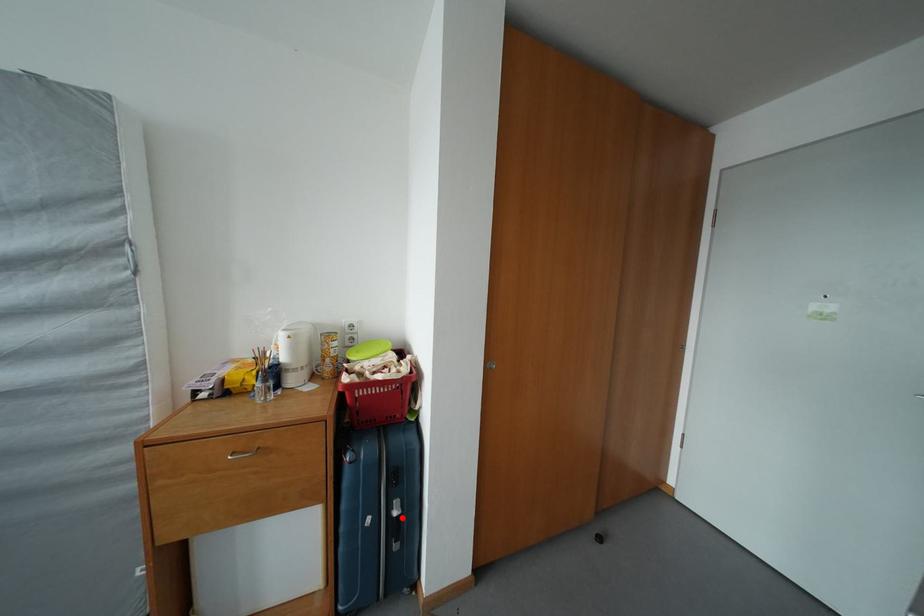
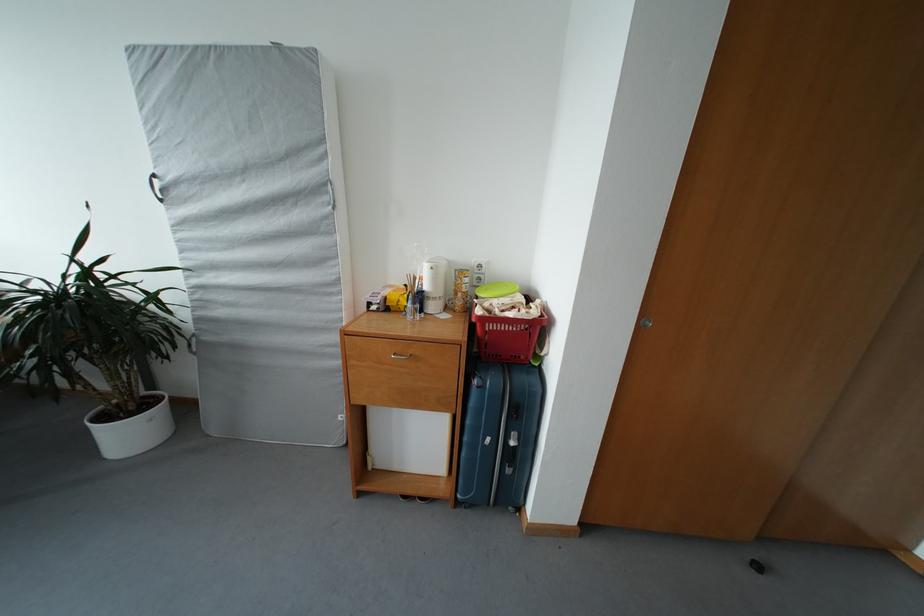
Find the pixel in the second image that matches the highlighted location in the first image.

(518, 448)